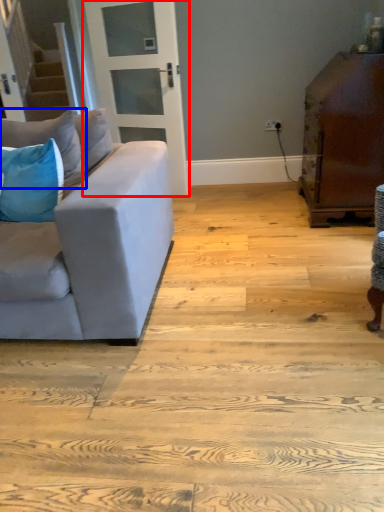
Question: Which of the following is the closest to the observer, door (highlighted by a red box) or pillow (highlighted by a blue box)?

Choices:
 (A) door
 (B) pillow

Answer: (B)